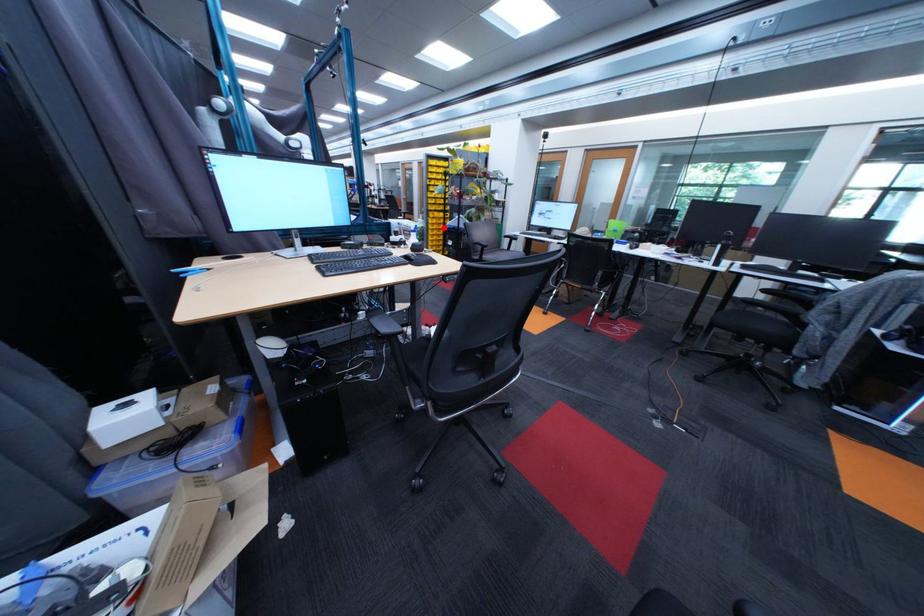
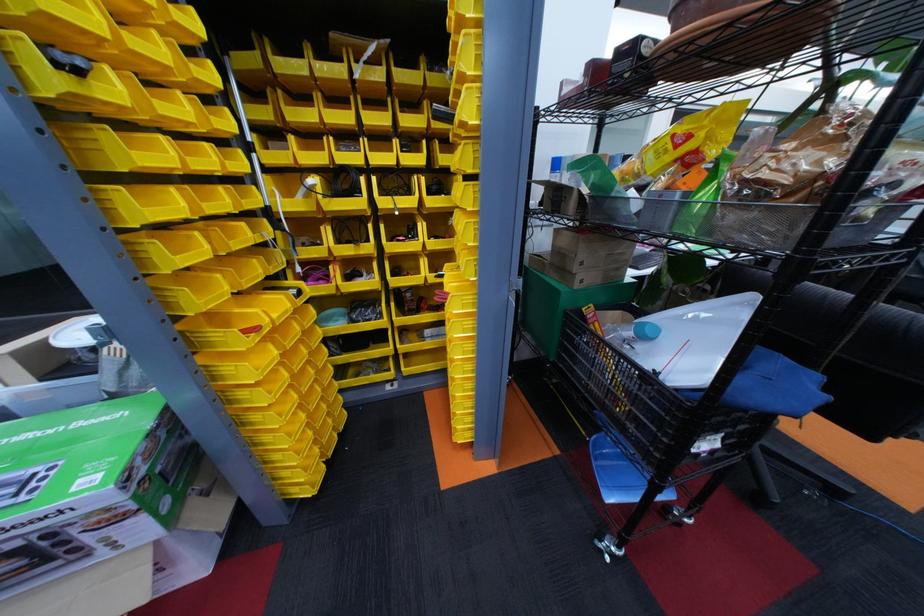
Find the pixel in the second image that matches the highlighted location in the first image.

(272, 400)